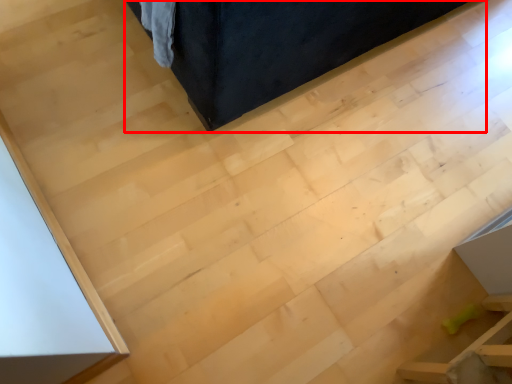
Question: Considering the relative positions of furniture (annotated by the red box) and furniture in the image provided, where is furniture (annotated by the red box) located with respect to the staircase?

Choices:
 (A) left
 (B) right

Answer: (A)